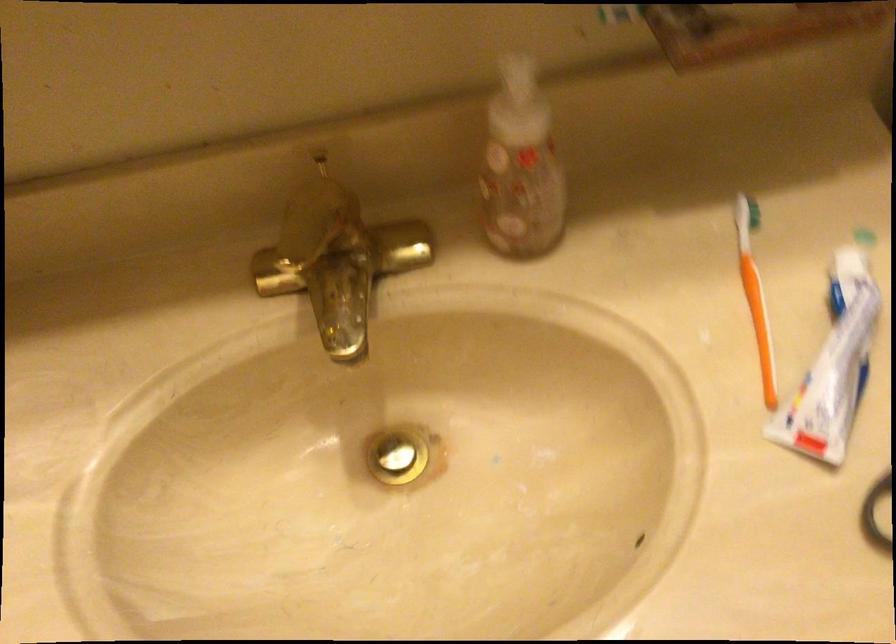
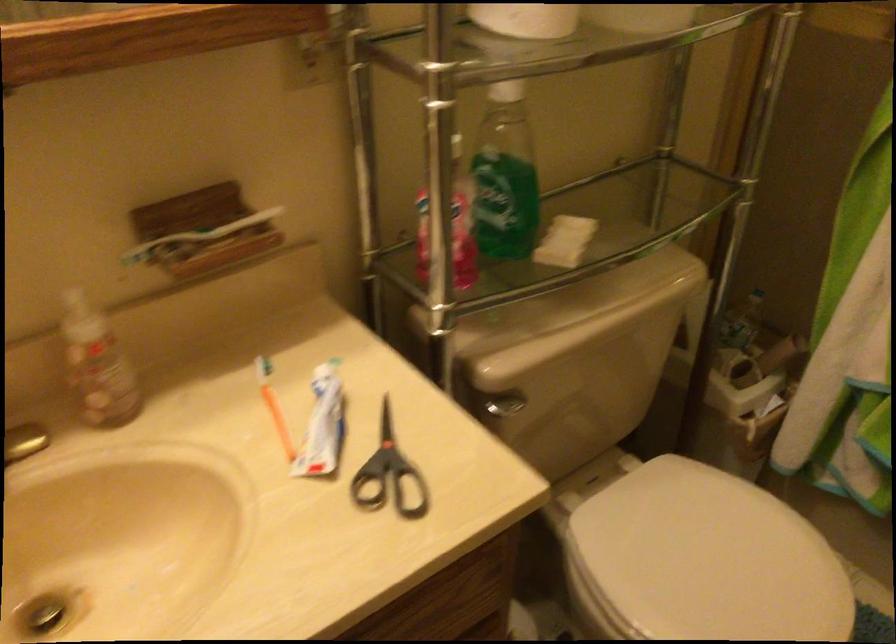
In the second image, find the point that corresponds to [742,290] in the first image.

(272, 406)